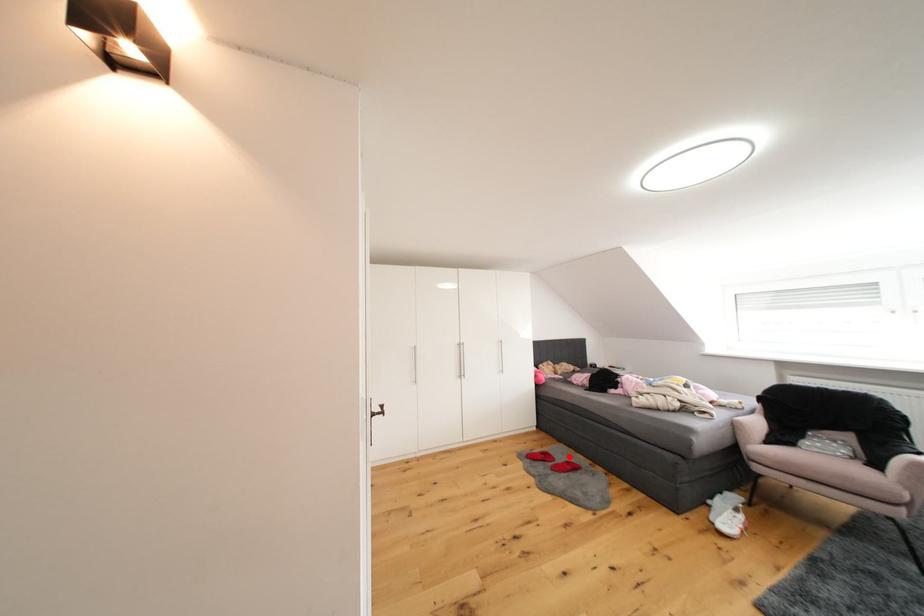
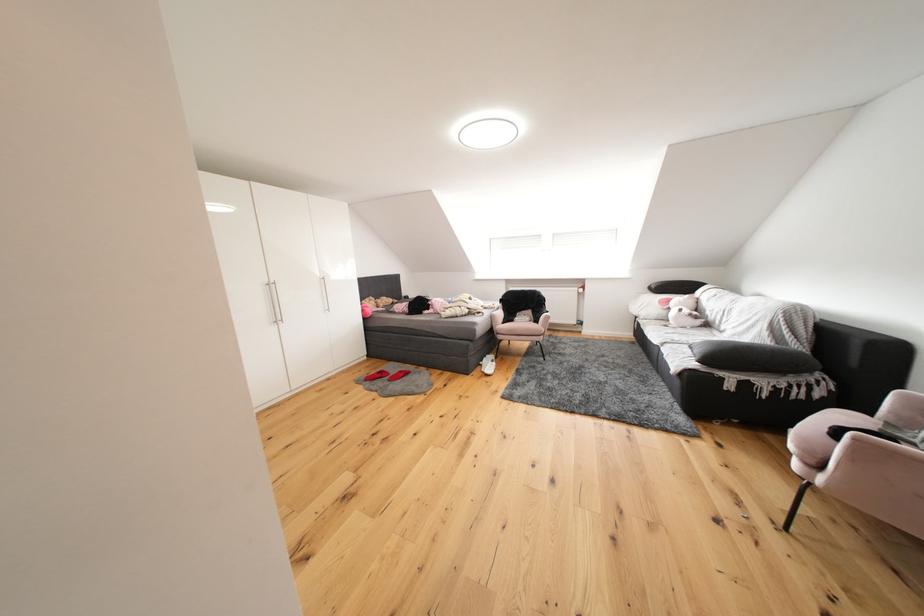
Question: I am providing you with two images of the same scene from different viewpoints. Given a red point in image1, look at the same physical point in image2. Is it:

Choices:
 (A) Closer to the viewpoint
 (B) Farther from the viewpoint

Answer: (B)